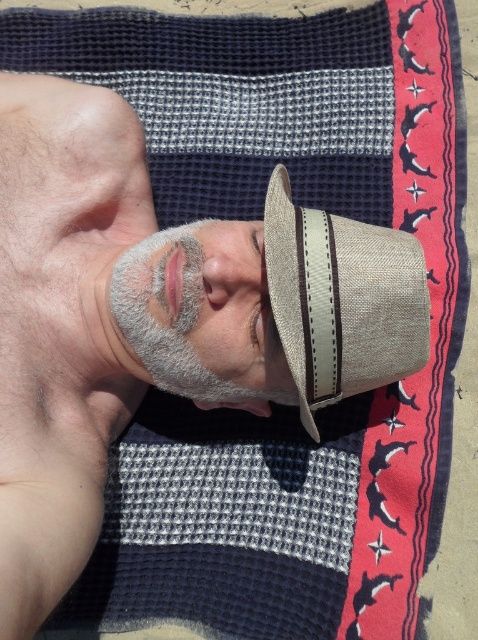
You are a photographer setting up a shot of a person on a beach towel. You need to ensure that the beige straw hat at center and the gray fabric face mask at center are both visible in the frame. Given their sizes, which object should you prioritize keeping centered to avoid cropping?

The beige straw hat at center is taller than the gray fabric face mask at center, so prioritize keeping the beige straw hat at center centered to avoid cropping since it is larger.

You are a photographer trying to capture the perfect shot of the person lying on the beach towel. You want to ensure both the beige straw hat at center and the gray fabric face mask at center are clearly visible in your composition. Based on their positions, which object should you focus on first to ensure both are in frame?

Since the beige straw hat at center is to the right of the gray fabric face mask at center, you should focus on the gray fabric face mask at center first to ensure both are included in the frame.